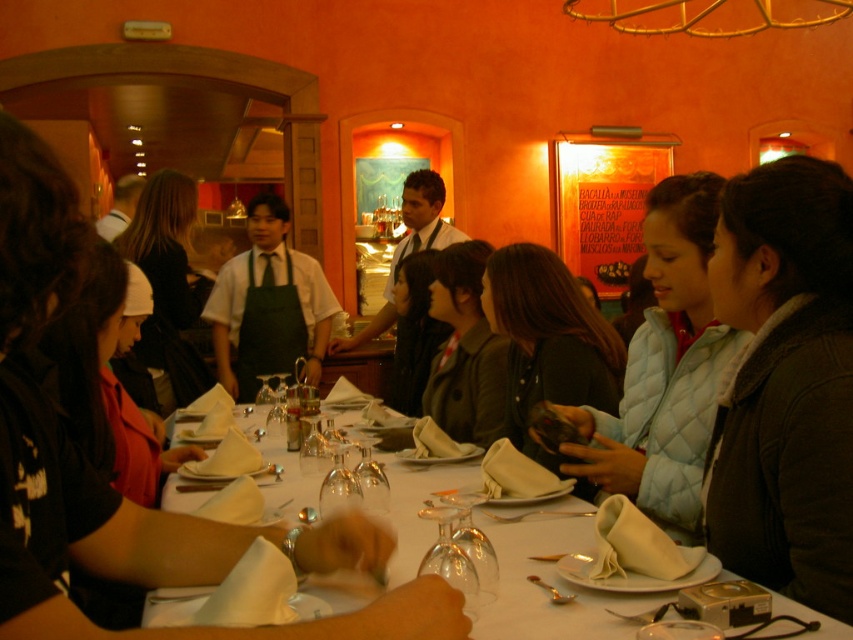
Question: From the image, what is the correct spatial relationship of matte black phone at center in relation to dark brown leather jacket at center?

Choices:
 (A) below
 (B) above

Answer: (A)

Question: Can you confirm if light blue quilted jacket at center is positioned below dark brown leather jacket at center?

Choices:
 (A) no
 (B) yes

Answer: (B)

Question: Which object is the farthest from the light blue quilted jacket at center?

Choices:
 (A) white cloth table at center
 (B) transparent glass wine glass at table center
 (C) matte black phone at center
 (D) dark brown leather jacket at lower right

Answer: (B)

Question: Which is farther from the matte black phone at center?

Choices:
 (A) light blue quilted jacket at center
 (B) transparent glass wine glass at table center

Answer: (B)

Question: Can you confirm if dark brown leather jacket at lower right is positioned above transparent glass wine glass at table center?

Choices:
 (A) yes
 (B) no

Answer: (A)

Question: Which object appears closest to the camera in this image?

Choices:
 (A) clear glass wine glass at center
 (B) shiny silver spoon at table center
 (C) dark brown leather jacket at center
 (D) white cloth table at center

Answer: (D)